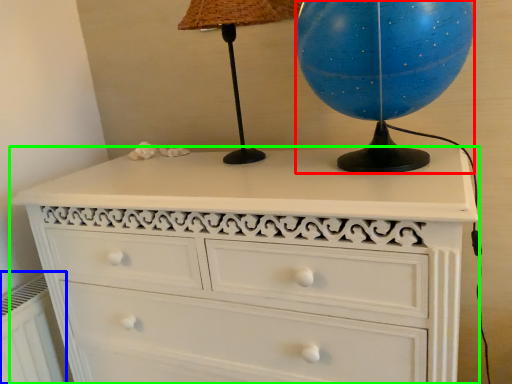
Question: Which object is positioned closest to sphere (highlighted by a red box)? Select from radiator (highlighted by a blue box) and chest of drawers (highlighted by a green box).

Choices:
 (A) radiator
 (B) chest of drawers

Answer: (B)